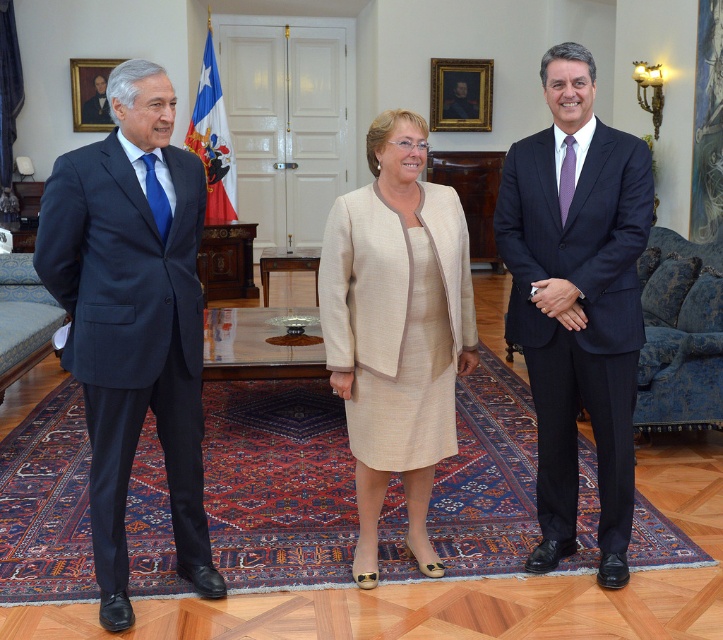
Between matte black suit at left and dark blue suit at right, which one appears on the left side from the viewer's perspective?

matte black suit at left is more to the left.

Identify the location of matte black suit at left. The height and width of the screenshot is (640, 723). (132, 317).

I want to click on matte black suit at left, so click(132, 317).

Where is `matte black suit at left`? Image resolution: width=723 pixels, height=640 pixels. matte black suit at left is located at coordinates (132, 317).

Which is more to the left, matte black suit at left or beige textured suit at center?

matte black suit at left is more to the left.

From the picture: Who is more distant from viewer, (111, 561) or (470, 358)?

Positioned behind is point (470, 358).

Locate an element on the screen. The image size is (723, 640). matte black suit at left is located at coordinates 132,317.

Can you confirm if dark blue suit at right is positioned to the right of beige textured suit at center?

Correct, you'll find dark blue suit at right to the right of beige textured suit at center.

Is dark blue suit at right wider than beige textured suit at center?

No, dark blue suit at right is not wider than beige textured suit at center.

Which is behind, point (539, 467) or point (380, 152)?

The point (539, 467) is behind.

Where is `dark blue suit at right`? This screenshot has height=640, width=723. dark blue suit at right is located at coordinates (577, 300).